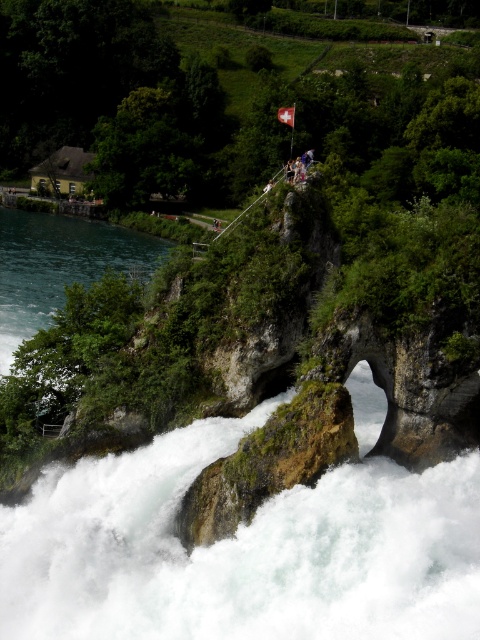
Does white frothy water at center have a lesser height compared to greenish-blue water at left?

Yes, white frothy water at center is shorter than greenish-blue water at left.

Does white frothy water at center lie behind greenish-blue water at left?

No, white frothy water at center is closer to the viewer.

Is point (265, 504) closer to camera compared to point (64, 280)?

Yes, point (265, 504) is closer to viewer.

At what (x,y) coordinates should I click in order to perform the action: click on white frothy water at center. Please return your answer as a coordinate pair (x, y). This screenshot has width=480, height=640. Looking at the image, I should click on (241, 550).

Does white frothy water at center have a lesser height compared to white fabric flag at center?

Yes.

From the picture: Who is positioned more to the right, white frothy water at center or white fabric flag at center?

From the viewer's perspective, white fabric flag at center appears more on the right side.

Does point (17, 515) come closer to viewer compared to point (287, 109)?

Yes, point (17, 515) is in front of point (287, 109).

Identify the location of white frothy water at center. This screenshot has height=640, width=480. (241, 550).

Is point (31, 314) positioned after point (283, 108)?

No, (31, 314) is in front of (283, 108).

What do you see at coordinates (60, 266) in the screenshot? The height and width of the screenshot is (640, 480). I see `greenish-blue water at left` at bounding box center [60, 266].

Identify the location of greenish-blue water at left. (60, 266).